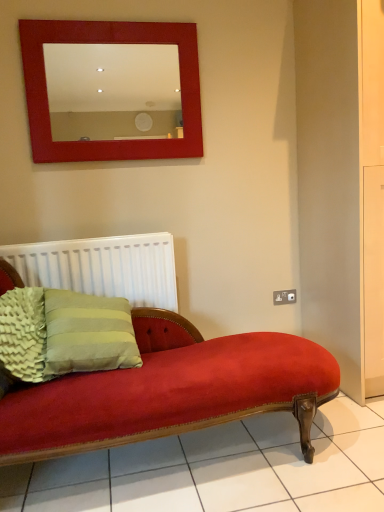
Question: Is green textured pillow at lower left taller or shorter than white plastic radiator at lower left?

Choices:
 (A) short
 (B) tall

Answer: (A)

Question: In terms of size, does green textured pillow at lower left appear bigger or smaller than white plastic radiator at lower left?

Choices:
 (A) big
 (B) small

Answer: (B)

Question: Estimate the real-world distances between objects in this image. Which object is closer to the green textured pillow at lower left?

Choices:
 (A) white plastic radiator at lower left
 (B) satin silver outlet at lower right

Answer: (A)

Question: Estimate the real-world distances between objects in this image. Which object is closer to the satin silver outlet at lower right?

Choices:
 (A) white plastic radiator at lower left
 (B) green textured pillow at lower left

Answer: (A)